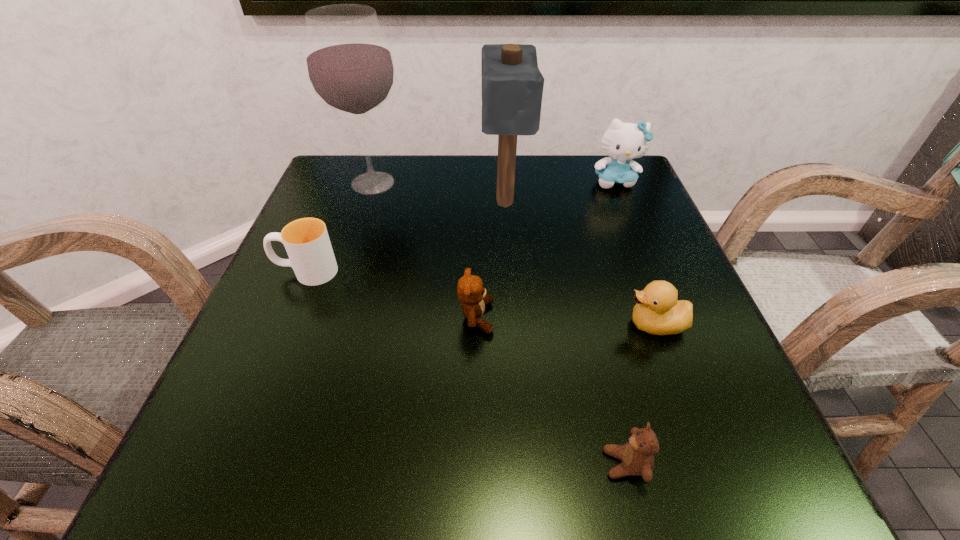
This screenshot has width=960, height=540. I want to click on vacant space at the left edge of the desktop, so click(x=280, y=360).

I want to click on free point at the right edge, so click(638, 287).

Locate an element on the screen. The height and width of the screenshot is (540, 960). vacant space at the far right corner of the desktop is located at coordinates (576, 171).

The image size is (960, 540). I want to click on blank area at the near right corner, so click(x=684, y=434).

Identify the location of vacant space that is in between the mallet and the kitten. The width and height of the screenshot is (960, 540). (560, 191).

Find the location of `vacant area between the duckling and the alcohol`. vacant area between the duckling and the alcohol is located at coordinates (515, 254).

Image resolution: width=960 pixels, height=540 pixels. In order to click on vacant space in between the alcohol and the fourth nearest object in this screenshot , I will do `click(340, 227)`.

Locate an element on the screen. This screenshot has width=960, height=540. vacant area between the left teddy bear and the mallet is located at coordinates (491, 260).

You are a GUI agent. You are given a task and a screenshot of the screen. Output one action in this format:
    pyautogui.click(x=<x>, y=<y>)
    Task: Click on the empty location between the duckling and the alcohol
    The width and height of the screenshot is (960, 540).
    Given the screenshot: What is the action you would take?
    pyautogui.click(x=515, y=254)

Where is `free spot between the left teddy bear and the kitten`? This screenshot has height=540, width=960. free spot between the left teddy bear and the kitten is located at coordinates (545, 249).